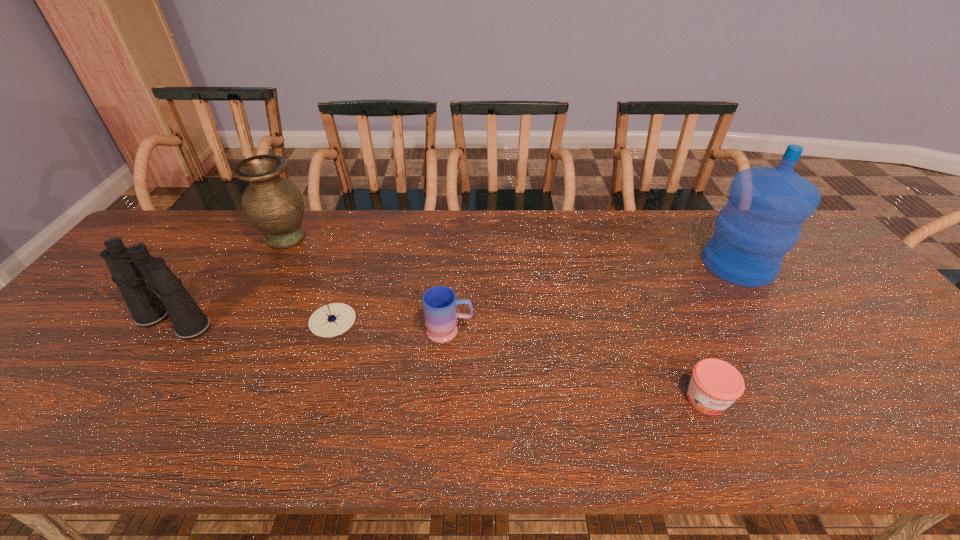
Identify the location of free space between the nearest object and the binoculars. (440, 361).

This screenshot has width=960, height=540. Identify the location of free space between the binoculars and the water jug. (x=456, y=294).

Where is `object that is the third closest to the binoculars`? The image size is (960, 540). object that is the third closest to the binoculars is located at coordinates (440, 304).

The image size is (960, 540). I want to click on object that is the second closest one to the binoculars, so (x=331, y=320).

What are the coordinates of `free region that satisfies the following two spatial constraints: 1. on the front side of the water jug; 2. on the left side of the vase` in the screenshot? It's located at (272, 265).

The width and height of the screenshot is (960, 540). Identify the location of free space in the image that satisfies the following two spatial constraints: 1. on the back side of the binoculars; 2. on the right side of the rightmost object. (214, 265).